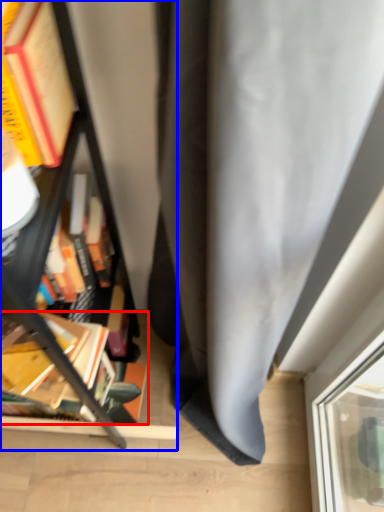
Question: Among these objects, which one is farthest to the camera, book (highlighted by a red box) or bookcase (highlighted by a blue box)?

Choices:
 (A) book
 (B) bookcase

Answer: (A)